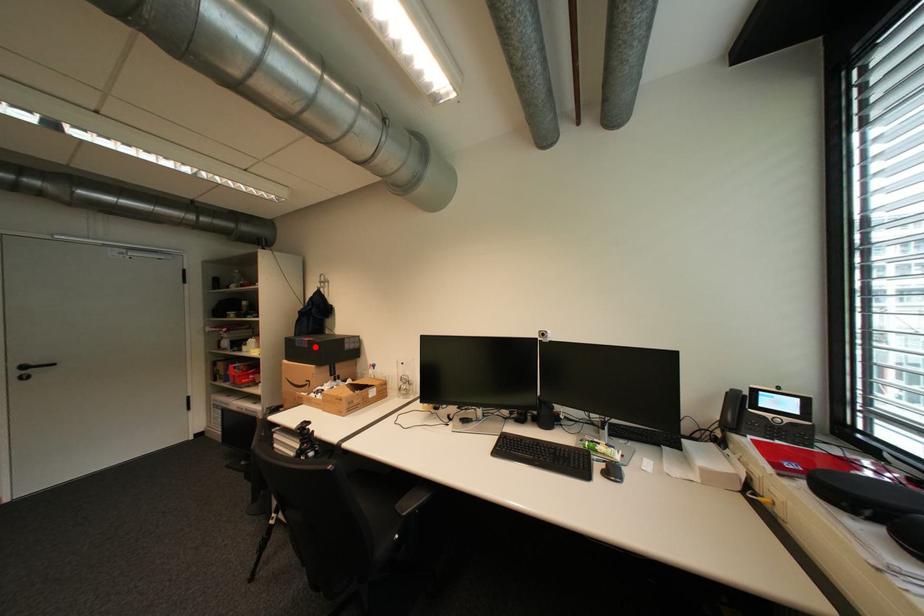
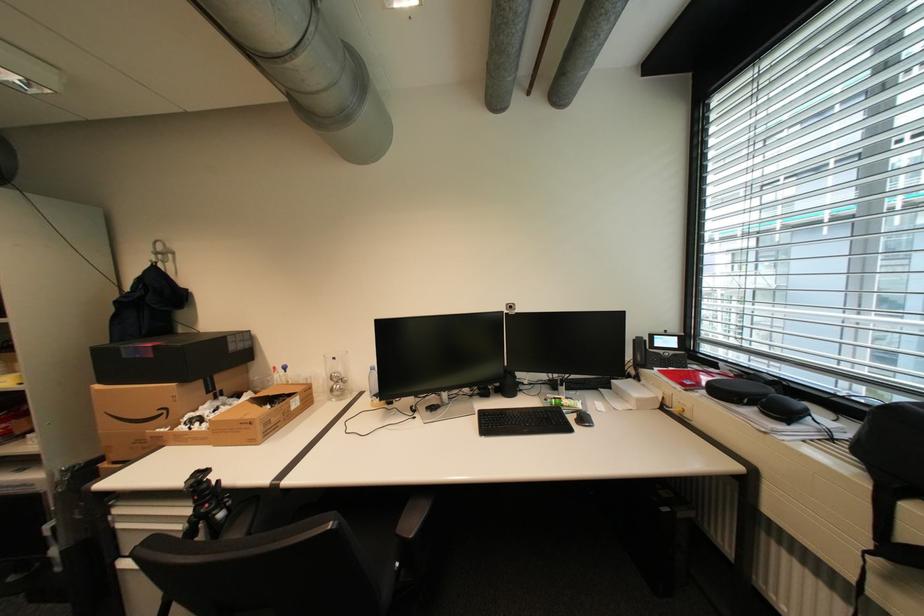
Find the pixel in the second image that matches the highlighted location in the first image.

(161, 357)